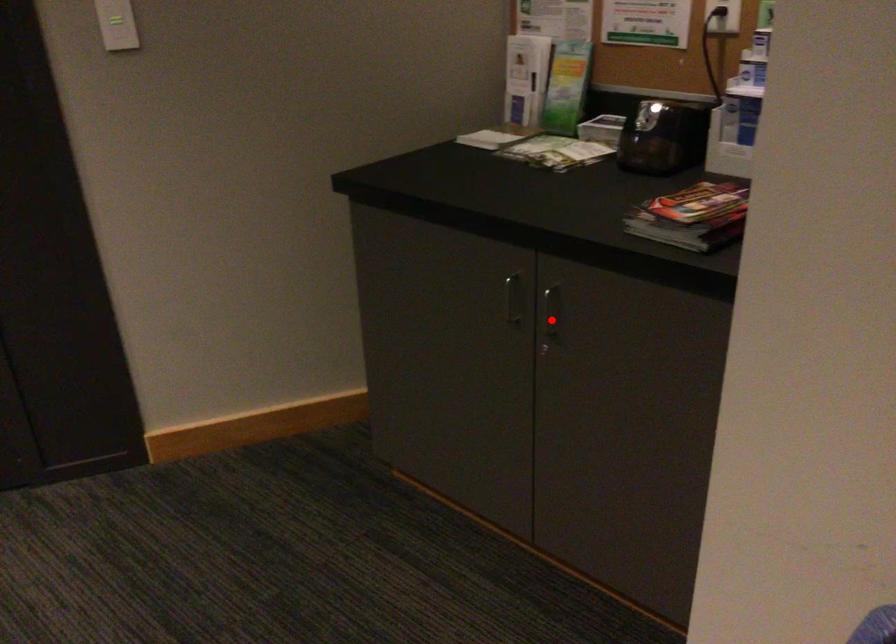
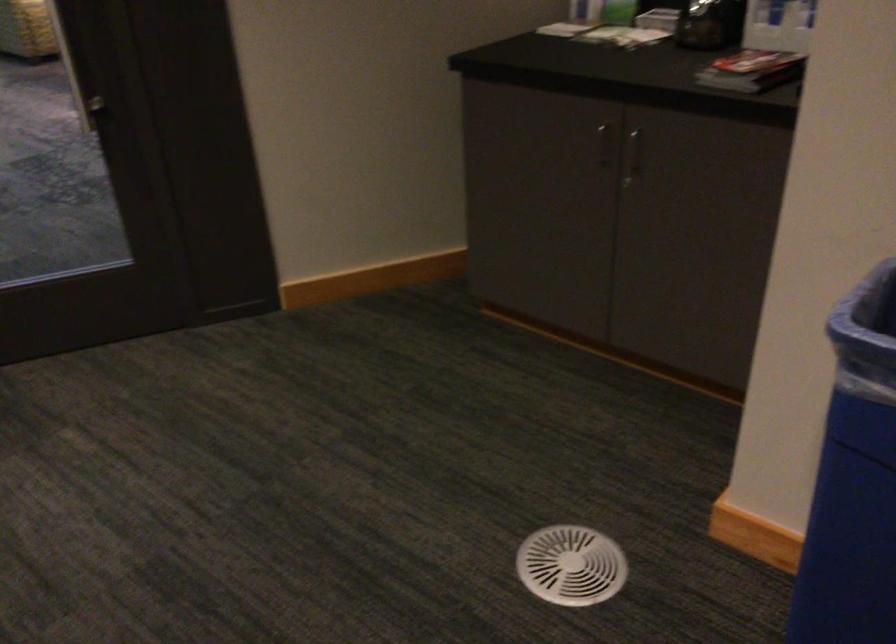
Question: I am providing you with two images of the same scene from different viewpoints. A red point is marked on the first image. Is the red point's position out of view in image 2?

Choices:
 (A) Yes
 (B) No

Answer: (B)